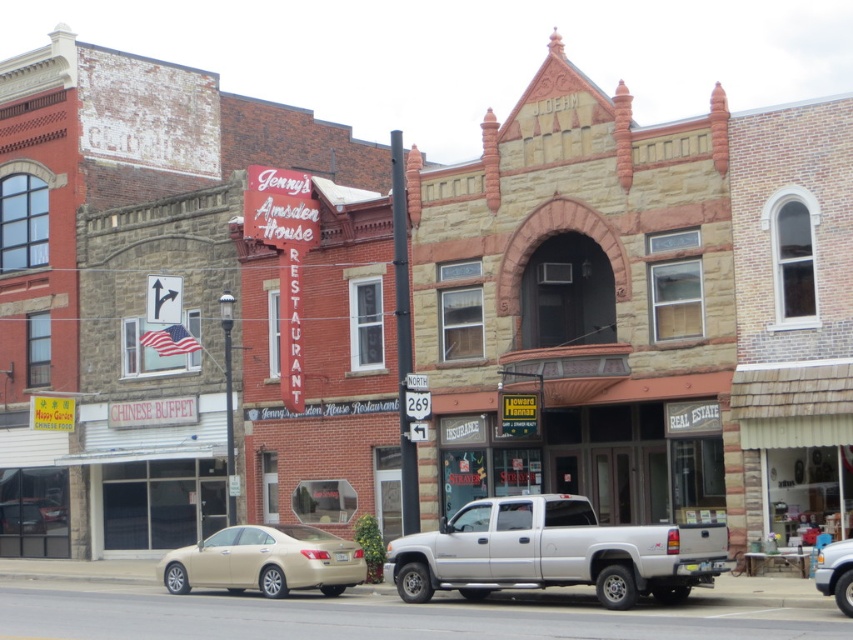
Question: Does silver metallic pickup truck at center have a smaller size compared to metallic silver truck at center?

Choices:
 (A) no
 (B) yes

Answer: (B)

Question: Can you confirm if silver metallic pickup truck at center is thinner than gold metallic sedan at center?

Choices:
 (A) yes
 (B) no

Answer: (A)

Question: Which point is farther from the camera taking this photo?

Choices:
 (A) (460, 560)
 (B) (221, 550)

Answer: (B)

Question: Which of the following is the farthest from the observer?

Choices:
 (A) gold metallic sedan at center
 (B) metallic silver truck at center
 (C) silver metallic pickup truck at center

Answer: (A)

Question: Which of the following is the farthest from the observer?

Choices:
 (A) silver metallic pickup truck at center
 (B) metallic silver truck at center

Answer: (A)

Question: Does silver metallic pickup truck at center have a lesser width compared to gold metallic sedan at center?

Choices:
 (A) no
 (B) yes

Answer: (B)